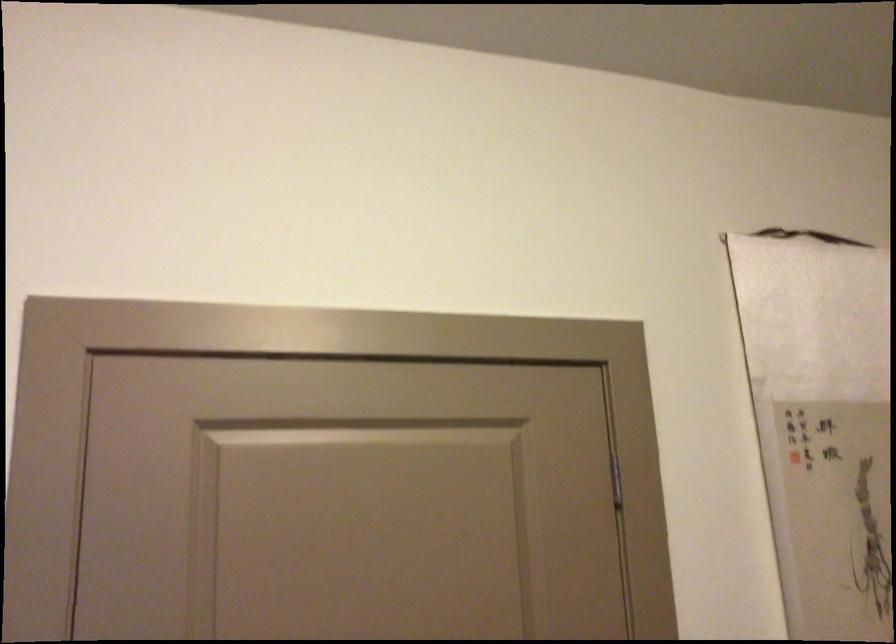
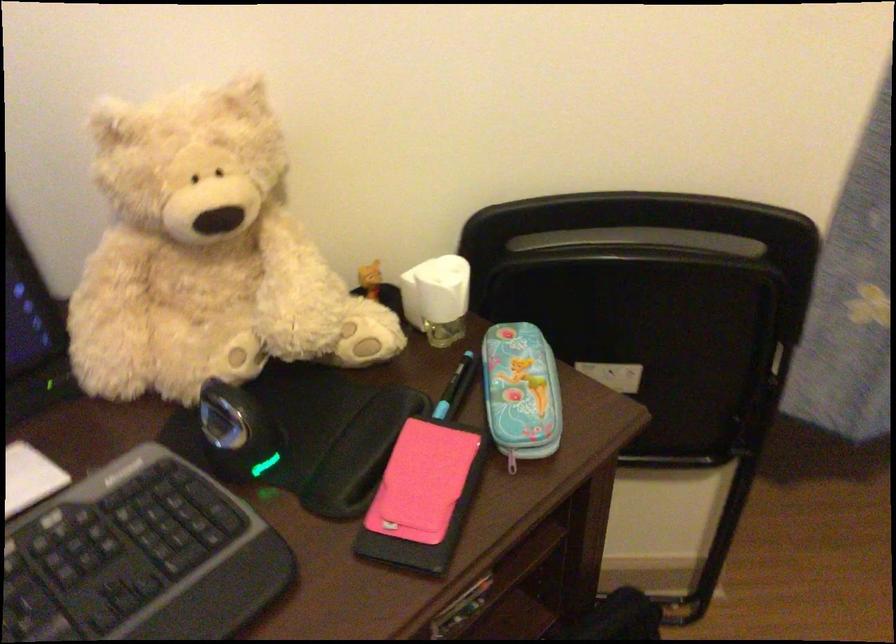
Based on the continuous images, in which direction is the camera rotating?

The camera's rotation is toward left-down.